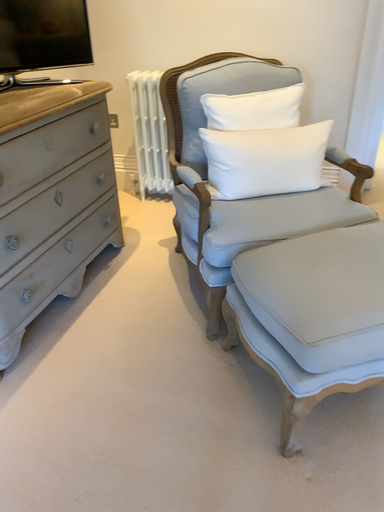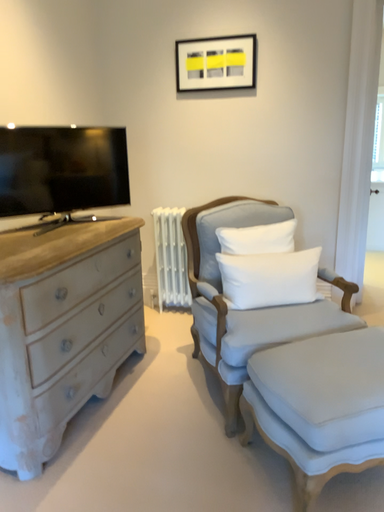
Question: How did the camera likely rotate when shooting the video?

Choices:
 (A) rotated upward
 (B) rotated downward

Answer: (A)